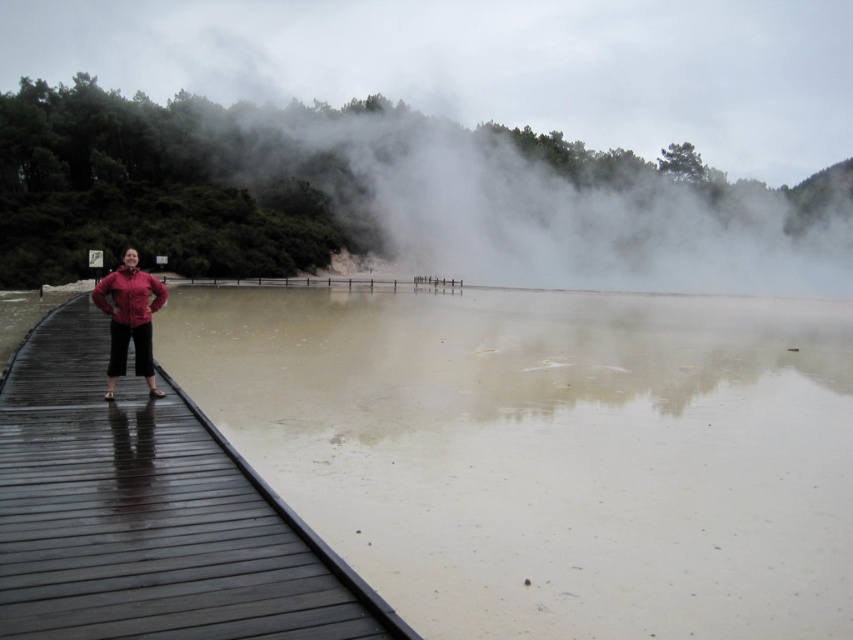
Question: Does muddy water at center have a greater width compared to matte red jacket at left?

Choices:
 (A) no
 (B) yes

Answer: (B)

Question: Which of these objects is positioned farthest from the white fog at center?

Choices:
 (A) muddy water at center
 (B) matte red jacket at left

Answer: (B)

Question: Based on their relative distances, which object is farther from the matte red jacket at center?

Choices:
 (A) white fog at center
 (B) dark wood dock at left
 (C) matte red jacket at left
 (D) muddy water at center

Answer: (A)

Question: Is dark wood dock at left below matte red jacket at left?

Choices:
 (A) yes
 (B) no

Answer: (A)

Question: Among these points, which one is nearest to the camera?

Choices:
 (A) (578, 445)
 (B) (143, 280)
 (C) (129, 294)

Answer: (C)

Question: Can you confirm if muddy water at center is positioned above matte red jacket at center?

Choices:
 (A) yes
 (B) no

Answer: (B)